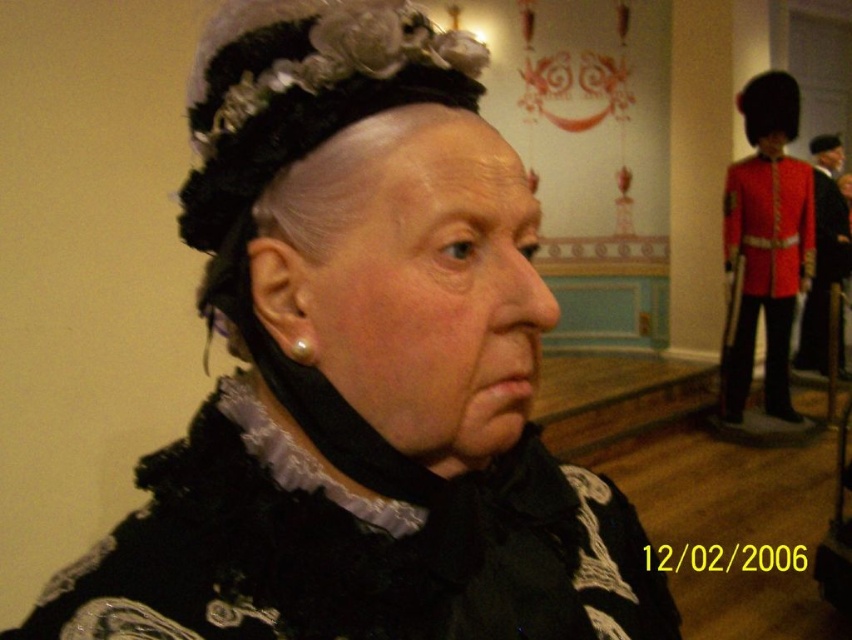
Question: Is black velvet dress at center positioned in front of red velvet jacket at right?

Choices:
 (A) yes
 (B) no

Answer: (A)

Question: Which point is closer to the camera?

Choices:
 (A) red woolen uniform at right
 (B) black velvet dress at center

Answer: (B)

Question: Does black velvet dress at center appear under red velvet jacket at right?

Choices:
 (A) yes
 (B) no

Answer: (A)

Question: Can you confirm if black velvet dress at center is positioned to the left of red velvet jacket at right?

Choices:
 (A) yes
 (B) no

Answer: (A)

Question: Which object appears farthest from the camera in this image?

Choices:
 (A) black velvet dress at center
 (B) red woolen uniform at right

Answer: (B)

Question: Which point is farther to the camera?

Choices:
 (A) (737, 250)
 (B) (317, 461)
 (C) (838, 188)

Answer: (C)